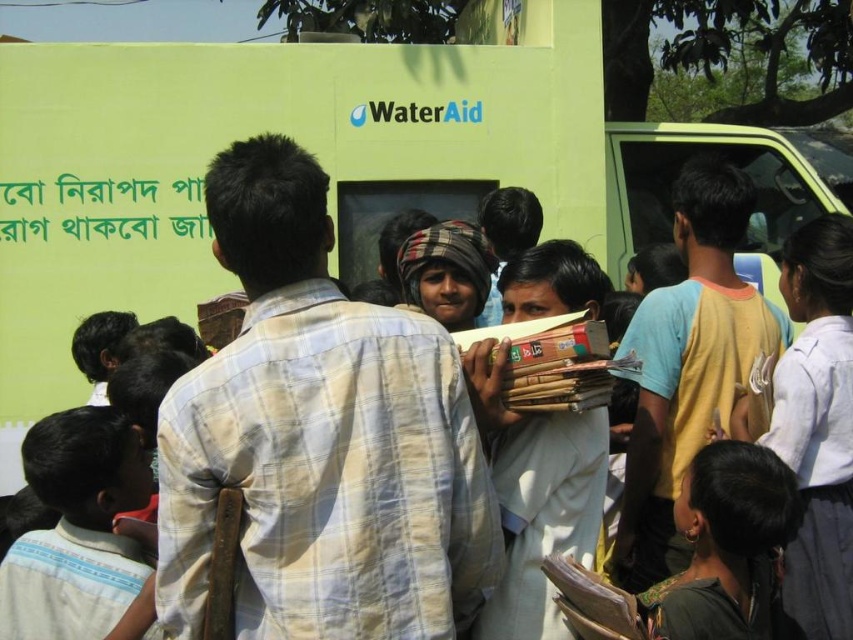
You are standing at the point with coordinates point (676,502) and want to walk towards the point (488,563). According to the scene, will you be moving forward or backward?

Since point (488,563) is in front of point (676,502), moving towards it would mean moving forward.